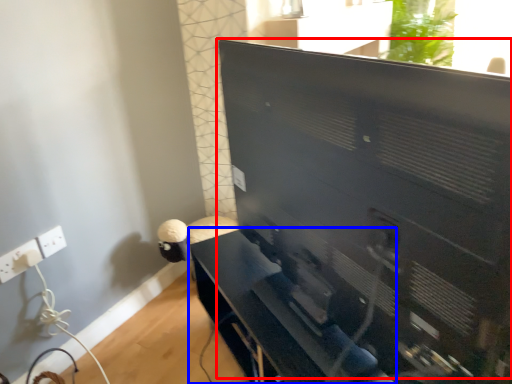
Question: Which of the following is the closest to the observer, computer monitor (highlighted by a red box) or furniture (highlighted by a blue box)?

Choices:
 (A) computer monitor
 (B) furniture

Answer: (A)